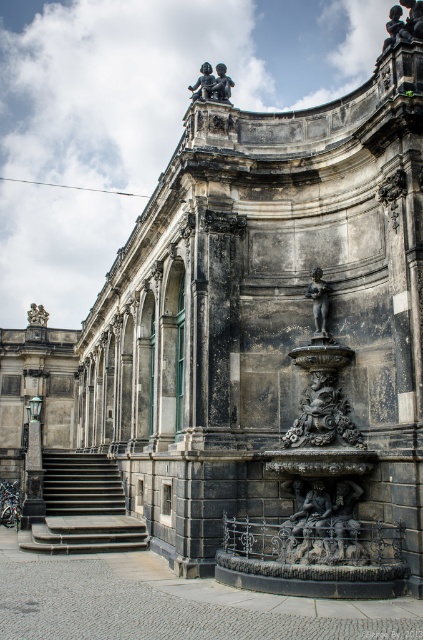
Question: Which object appears closest to the camera in this image?

Choices:
 (A) polished bronze statue at upper center
 (B) polished bronze lamp post at left

Answer: (A)

Question: Which point is closer to the camera taking this photo?

Choices:
 (A) (40, 481)
 (B) (368, 554)

Answer: (B)

Question: Is dark gray stone fountain at center in front of polished bronze lamp post at left?

Choices:
 (A) no
 (B) yes

Answer: (B)

Question: From the image, what is the correct spatial relationship of dark gray stone stairs at lower left in relation to dark stone sculpture at lower center?

Choices:
 (A) right
 (B) left

Answer: (B)

Question: Does dark gray stone fountain at center have a larger size compared to dark gray stone stairs at lower left?

Choices:
 (A) yes
 (B) no

Answer: (B)

Question: Estimate the real-world distances between objects in this image. Which object is closer to the bronze statue at upper left?

Choices:
 (A) matte bronze statue at center
 (B) dark gray stone fountain at center
 (C) polished bronze lamp post at left

Answer: (C)